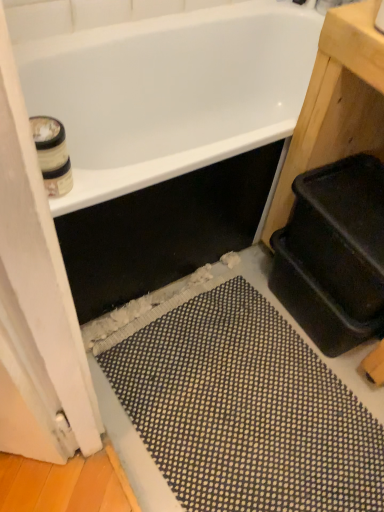
Question: Considering the relative positions of black rubber bath mat at lower center and white glossy bathtub at upper center in the image provided, is black rubber bath mat at lower center to the right of white glossy bathtub at upper center from the viewer's perspective?

Choices:
 (A) yes
 (B) no

Answer: (A)

Question: Is black rubber bath mat at lower center facing away from white glossy bathtub at upper center?

Choices:
 (A) no
 (B) yes

Answer: (A)

Question: Is black rubber bath mat at lower center oriented towards white glossy bathtub at upper center?

Choices:
 (A) yes
 (B) no

Answer: (B)

Question: Can white glossy bathtub at upper center be found inside black rubber bath mat at lower center?

Choices:
 (A) yes
 (B) no

Answer: (B)

Question: Considering the relative positions of black rubber bath mat at lower center and white glossy bathtub at upper center in the image provided, is black rubber bath mat at lower center to the left of white glossy bathtub at upper center from the viewer's perspective?

Choices:
 (A) no
 (B) yes

Answer: (A)

Question: From a real-world perspective, is black rubber bath mat at lower center positioned under white glossy bathtub at upper center based on gravity?

Choices:
 (A) yes
 (B) no

Answer: (A)

Question: Is white wood screen door at left not inside black rubber bath mat at lower center?

Choices:
 (A) yes
 (B) no

Answer: (A)

Question: Is black rubber bath mat at lower center inside white wood screen door at left?

Choices:
 (A) yes
 (B) no

Answer: (B)

Question: From the image's perspective, is white wood screen door at left located beneath black rubber bath mat at lower center?

Choices:
 (A) yes
 (B) no

Answer: (B)

Question: Does white wood screen door at left have a smaller size compared to black rubber bath mat at lower center?

Choices:
 (A) yes
 (B) no

Answer: (A)

Question: Considering the relative sizes of white wood screen door at left and black rubber bath mat at lower center in the image provided, is white wood screen door at left wider than black rubber bath mat at lower center?

Choices:
 (A) yes
 (B) no

Answer: (B)

Question: Would you consider white wood screen door at left to be distant from black rubber bath mat at lower center?

Choices:
 (A) no
 (B) yes

Answer: (A)

Question: Can we say white cardboard toilet paper at upper left lies outside white glossy bathtub at upper center?

Choices:
 (A) no
 (B) yes

Answer: (B)